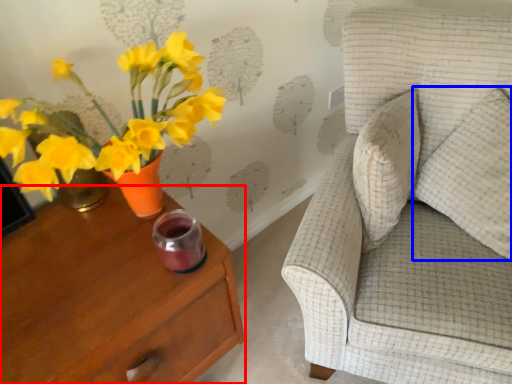
Question: Among these objects, which one is farthest to the camera, nightstand (highlighted by a red box) or pillow (highlighted by a blue box)?

Choices:
 (A) nightstand
 (B) pillow

Answer: (B)